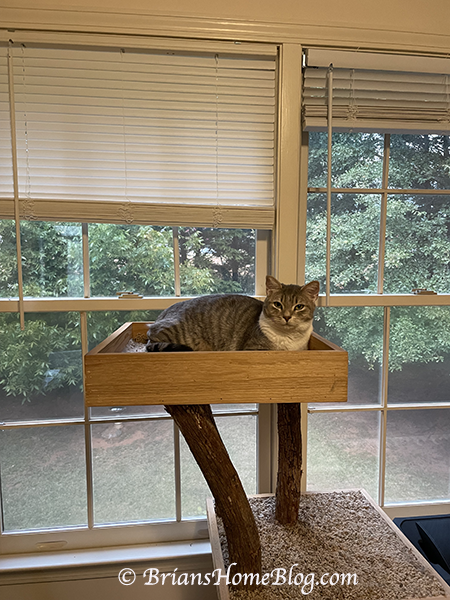
The image size is (450, 600). In order to click on window sill in this screenshot , I will do `click(162, 549)`.